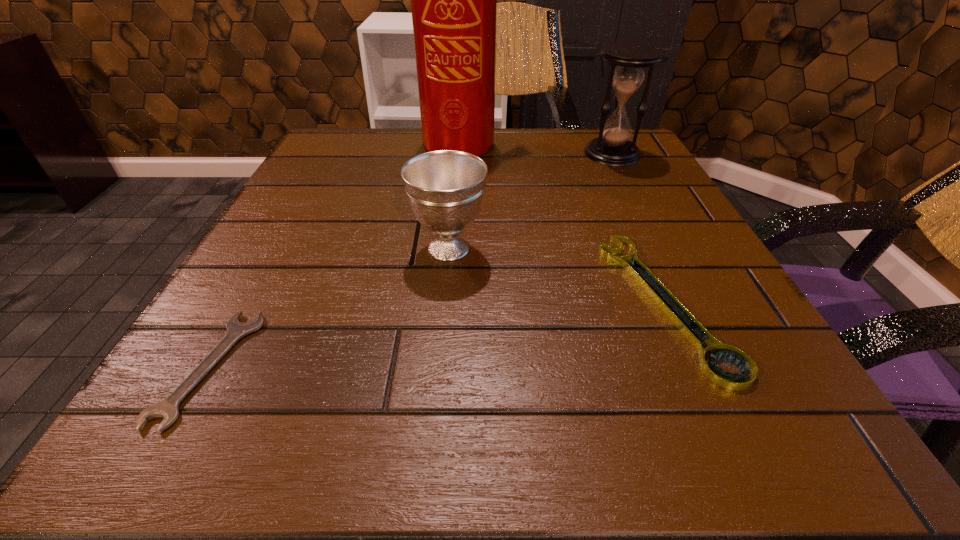
Where is `the tallest object`? Image resolution: width=960 pixels, height=540 pixels. the tallest object is located at coordinates (453, 0).

I want to click on the second tallest object, so click(x=612, y=147).

This screenshot has width=960, height=540. I want to click on chalice, so click(445, 188).

The image size is (960, 540). I want to click on the right wrench, so click(696, 333).

The height and width of the screenshot is (540, 960). I want to click on the second shortest object, so click(x=696, y=333).

Where is `the shorter wrench`? This screenshot has width=960, height=540. the shorter wrench is located at coordinates (168, 408).

Identify the location of the leftmost object. The image size is (960, 540). (168, 408).

Where is `free region located on the front of the fire extinguisher`? free region located on the front of the fire extinguisher is located at coordinates (456, 273).

This screenshot has height=540, width=960. Find the location of `free space located on the front of the fourth shortest object`. free space located on the front of the fourth shortest object is located at coordinates (654, 238).

Locate an element on the screen. Image resolution: width=960 pixels, height=540 pixels. free space located on the right of the third shortest object is located at coordinates (651, 248).